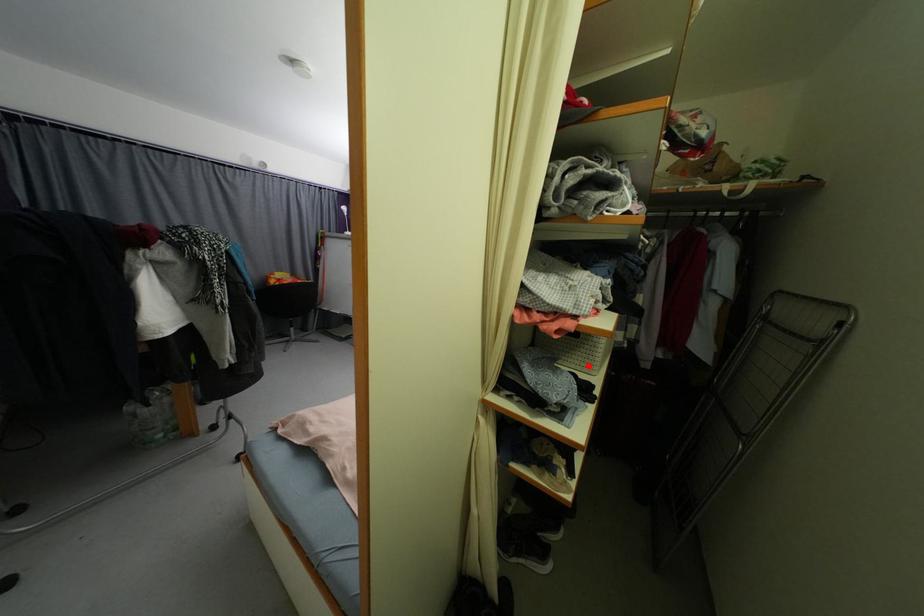
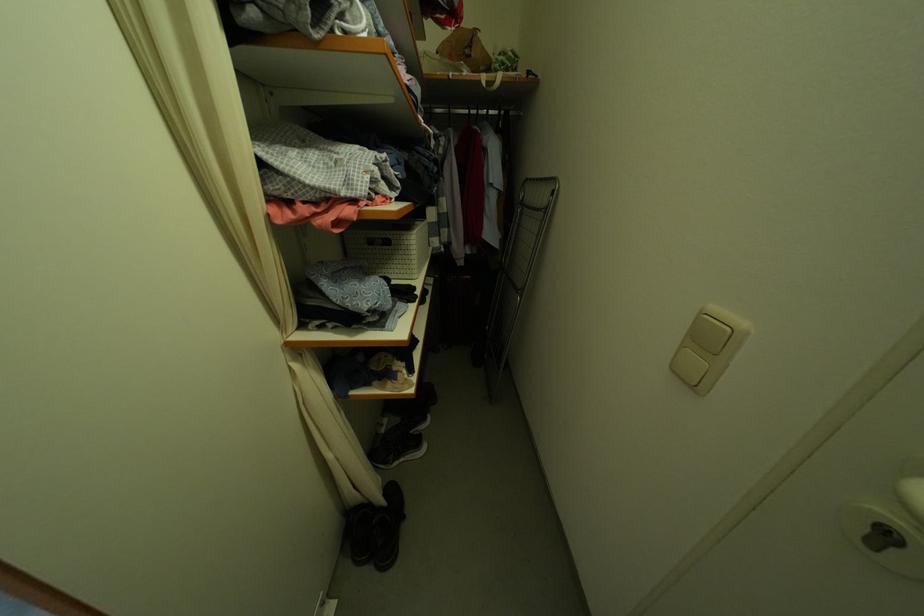
Find the pixel in the second image that matches the highlighted location in the first image.

(407, 273)